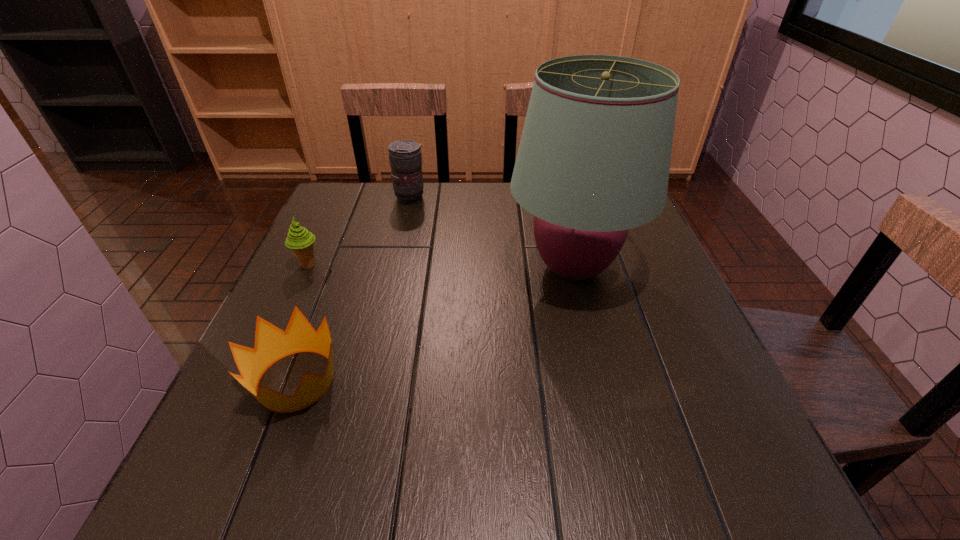
Locate an element on the screen. vacant space located on the front of the nearest object is located at coordinates (260, 475).

Where is `object present at the far edge`? object present at the far edge is located at coordinates (405, 158).

Where is `icecream located at the left edge`? The image size is (960, 540). icecream located at the left edge is located at coordinates (301, 242).

The image size is (960, 540). I want to click on crown that is positioned at the left edge, so click(x=271, y=343).

Find the location of a particular element. The height and width of the screenshot is (540, 960). object that is at the right edge is located at coordinates (594, 157).

Identify the location of vacant area at the far edge of the desktop. Image resolution: width=960 pixels, height=540 pixels. (517, 208).

In the image, there is a desktop. Where is `vacant space at the near edge`? This screenshot has width=960, height=540. vacant space at the near edge is located at coordinates (441, 460).

Where is `vacant region at the left edge of the desktop`? vacant region at the left edge of the desktop is located at coordinates (303, 288).

Locate an element on the screen. This screenshot has height=540, width=960. free space at the right edge of the desktop is located at coordinates (651, 429).

Find the location of `free space at the far left corner`. free space at the far left corner is located at coordinates (346, 225).